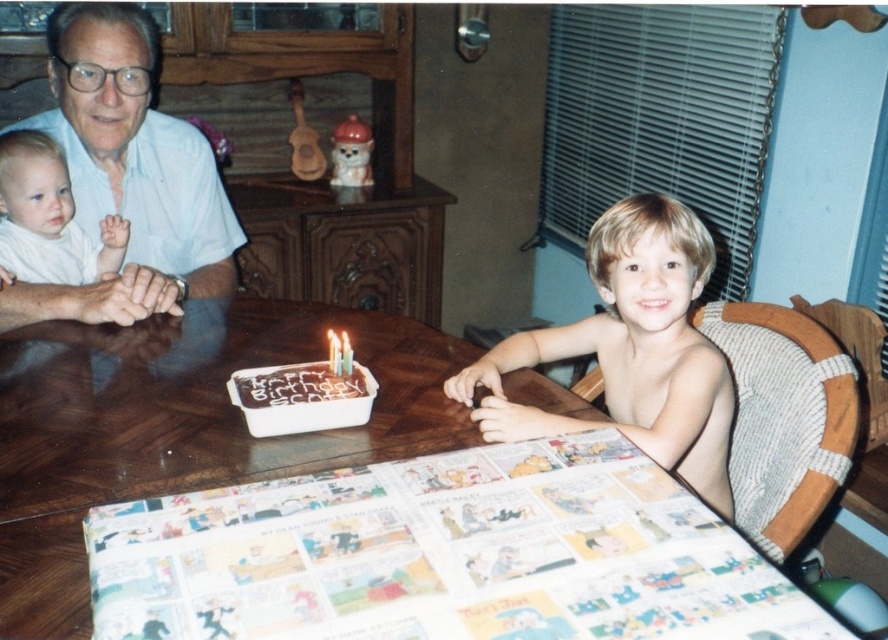
Question: Is matte white shirt at upper left to the left of blonde hair at upper right from the viewer's perspective?

Choices:
 (A) no
 (B) yes

Answer: (B)

Question: Does blonde hair at upper right have a smaller size compared to white soft baby at upper left?

Choices:
 (A) yes
 (B) no

Answer: (B)

Question: Estimate the real-world distances between objects in this image. Which object is closer to the brown wooden table at center?

Choices:
 (A) white wax candle at center
 (B) blonde hair at upper right
 (C) matte white shirt at upper left

Answer: (A)

Question: Which point is closer to the camera?

Choices:
 (A) white wax candle at center
 (B) white soft baby at upper left
 (C) matte white shirt at upper left
 (D) brown wooden table at center

Answer: (D)

Question: Which object appears closest to the camera in this image?

Choices:
 (A) chocolate frosted cake at center
 (B) white soft baby at upper left

Answer: (A)

Question: From the image, what is the correct spatial relationship of brown wooden table at center in relation to white wax candle at center?

Choices:
 (A) right
 (B) left

Answer: (B)